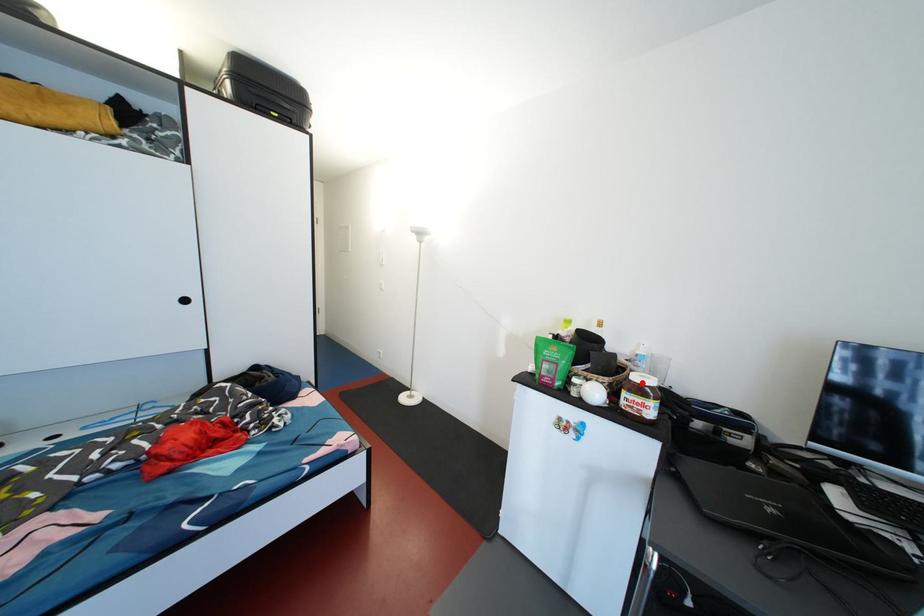
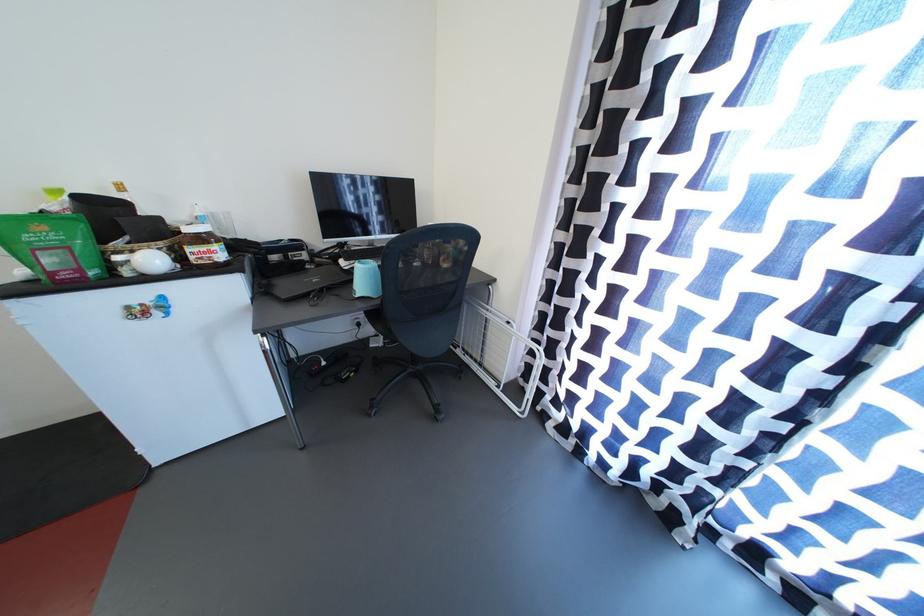
Find the pixel in the second image that matches the highlighted location in the first image.

(195, 235)